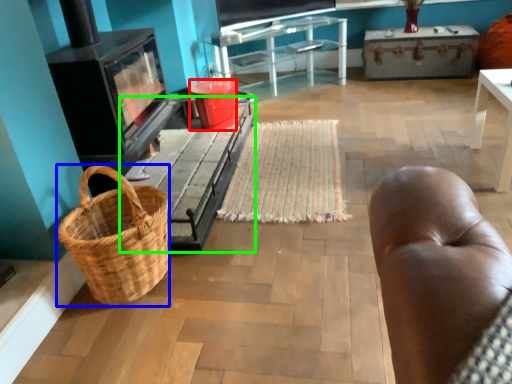
Question: Estimate the real-world distances between objects in this image. Which object is closer to bucket (highlighted by a red box), picnic basket (highlighted by a blue box) or table (highlighted by a green box)?

Choices:
 (A) picnic basket
 (B) table

Answer: (B)